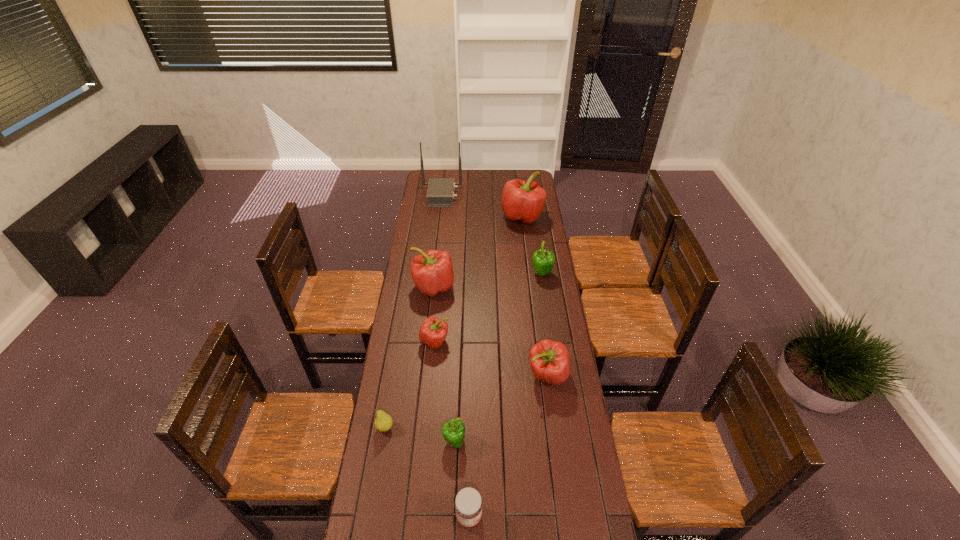
Locate an element on the screen. pear is located at coordinates (383, 422).

Find the location of a particular element. The height and width of the screenshot is (540, 960). the fifth nearest object is located at coordinates (433, 331).

I want to click on the smallest pink bell pepper, so click(433, 331).

The width and height of the screenshot is (960, 540). I want to click on jam, so click(x=468, y=504).

This screenshot has width=960, height=540. I want to click on the nearest object, so click(468, 504).

Find the location of a particular element. blank area located 0.220m on the back of the router to connect cables is located at coordinates (497, 195).

Find the location of a particular element. Image resolution: width=960 pixels, height=540 pixels. free spot located on the left of the biggest pink bell pepper is located at coordinates (478, 217).

This screenshot has width=960, height=540. What are the coordinates of `free space located 0.150m on the right of the second farthest pink bell pepper` in the screenshot? It's located at (487, 287).

In order to click on vacant region located on the back of the farther green bell pepper in this screenshot , I will do `click(538, 248)`.

At what (x,y) coordinates should I click in order to perform the action: click on free spot located 0.400m on the left of the nearest pink bell pepper. Please return your answer as a coordinate pair (x, y). Looking at the image, I should click on (427, 375).